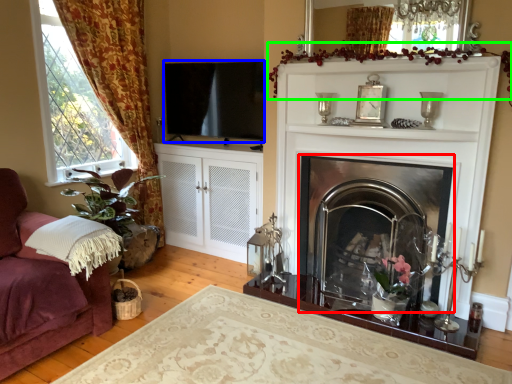
Question: Which object is the closest to the fireplace (highlighted by a red box)? Choose among these: window screen (highlighted by a blue box) or plant (highlighted by a green box).

Choices:
 (A) window screen
 (B) plant

Answer: (B)